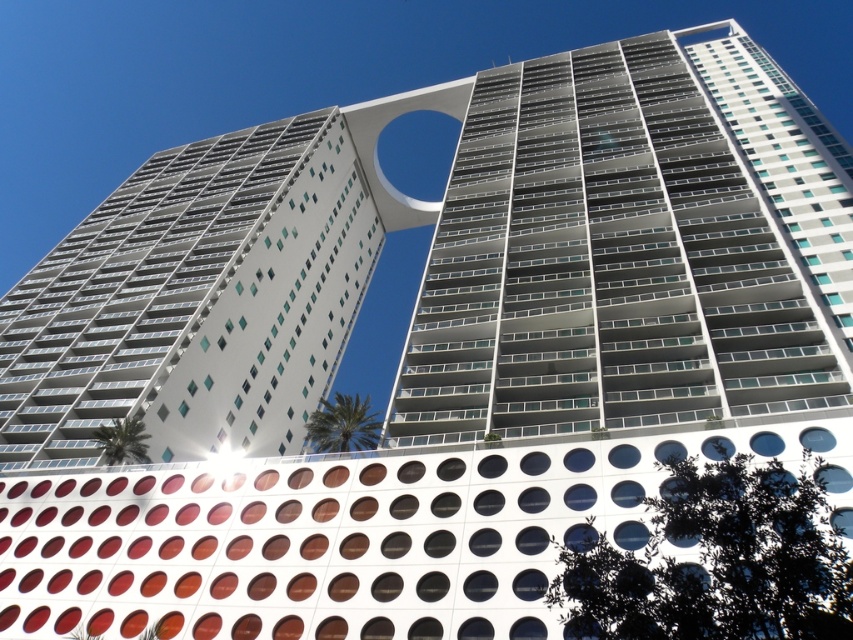
You are an architect reviewing the design of a new highrise. You notice two buildings in the scene, the metallic glass building at center and the white glass building at center. Which one appears to be taller based on their positions in the image?

The metallic glass building at center is positioned over the white glass building at center, indicating it is taller.

You are an architect evaluating the design of the two buildings in the image. Which building has a greater width between the metallic glass building at center and the white glass building at center?

The metallic glass building at center has a greater width than the white glass building at center as stated in the description.

You are a drone operator who needs to deliver a package between two buildings in the image. The drone has a maximum flight range of 30 meters. Can the drone safely deliver the package from the metallic glass building at center to the white glass building at center without exceeding its range?

The distance between the metallic glass building at center and the white glass building at center is 31.22 meters, which exceeds the drone operator maximum flight range of 30 meters. Therefore, the drone cannot safely deliver the package between them without exceeding its range.